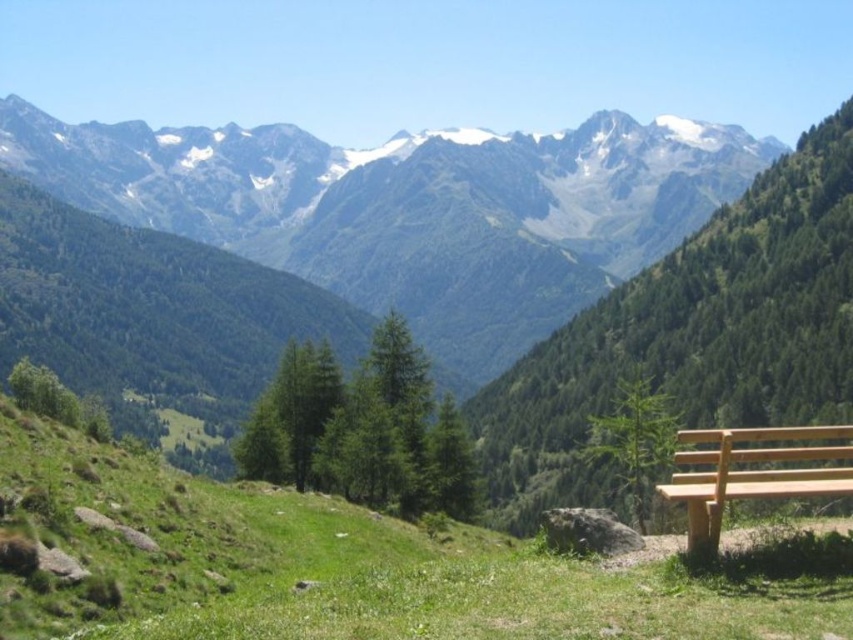
Question: Which point is farther to the camera?

Choices:
 (A) green textured mountains at upper center
 (B) green grassy at lower center
 (C) light brown wood bench at lower right

Answer: (A)

Question: Is green grassy at lower center above light brown wood bench at lower right?

Choices:
 (A) no
 (B) yes

Answer: (A)

Question: Does green grassy at lower center have a smaller size compared to light brown wood bench at lower right?

Choices:
 (A) yes
 (B) no

Answer: (A)

Question: Which point is farther from the camera taking this photo?

Choices:
 (A) (428, 314)
 (B) (747, 456)
 (C) (582, 561)

Answer: (A)

Question: Is green textured mountains at upper center further to camera compared to green grassy at lower center?

Choices:
 (A) no
 (B) yes

Answer: (B)

Question: Which is nearer to the green textured mountains at upper center?

Choices:
 (A) green grassy at lower center
 (B) light brown wood bench at lower right

Answer: (A)